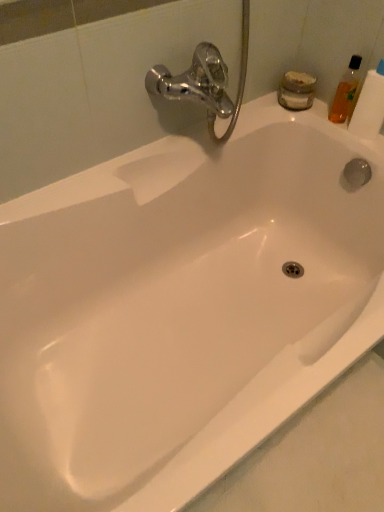
Question: Can you confirm if translucent orange bottle at upper right is shorter than translucent plastic toilet paper at upper right?

Choices:
 (A) no
 (B) yes

Answer: (B)

Question: Is translucent orange bottle at upper right next to translucent plastic toilet paper at upper right?

Choices:
 (A) yes
 (B) no

Answer: (A)

Question: Is translucent orange bottle at upper right positioned with its back to translucent plastic toilet paper at upper right?

Choices:
 (A) no
 (B) yes

Answer: (A)

Question: From a real-world perspective, is translucent orange bottle at upper right positioned under translucent plastic toilet paper at upper right based on gravity?

Choices:
 (A) yes
 (B) no

Answer: (A)

Question: Is translucent orange bottle at upper right at the left side of translucent plastic toilet paper at upper right?

Choices:
 (A) yes
 (B) no

Answer: (A)

Question: Is translucent orange bottle at upper right closer to camera compared to translucent plastic toilet paper at upper right?

Choices:
 (A) no
 (B) yes

Answer: (A)

Question: From a real-world perspective, is translucent plastic toilet paper at upper right below translucent orange bottle at upper right?

Choices:
 (A) no
 (B) yes

Answer: (A)

Question: From a real-world perspective, is translucent plastic toilet paper at upper right over translucent orange bottle at upper right?

Choices:
 (A) yes
 (B) no

Answer: (A)

Question: Is translucent plastic toilet paper at upper right behind translucent orange bottle at upper right?

Choices:
 (A) no
 (B) yes

Answer: (A)

Question: Is the depth of translucent plastic toilet paper at upper right less than that of translucent orange bottle at upper right?

Choices:
 (A) yes
 (B) no

Answer: (A)

Question: Does translucent plastic toilet paper at upper right have a greater width compared to translucent orange bottle at upper right?

Choices:
 (A) yes
 (B) no

Answer: (A)

Question: Is translucent plastic toilet paper at upper right smaller than translucent orange bottle at upper right?

Choices:
 (A) no
 (B) yes

Answer: (A)

Question: Is translucent plastic toilet paper at upper right in front of or behind translucent orange bottle at upper right in the image?

Choices:
 (A) front
 (B) behind

Answer: (A)